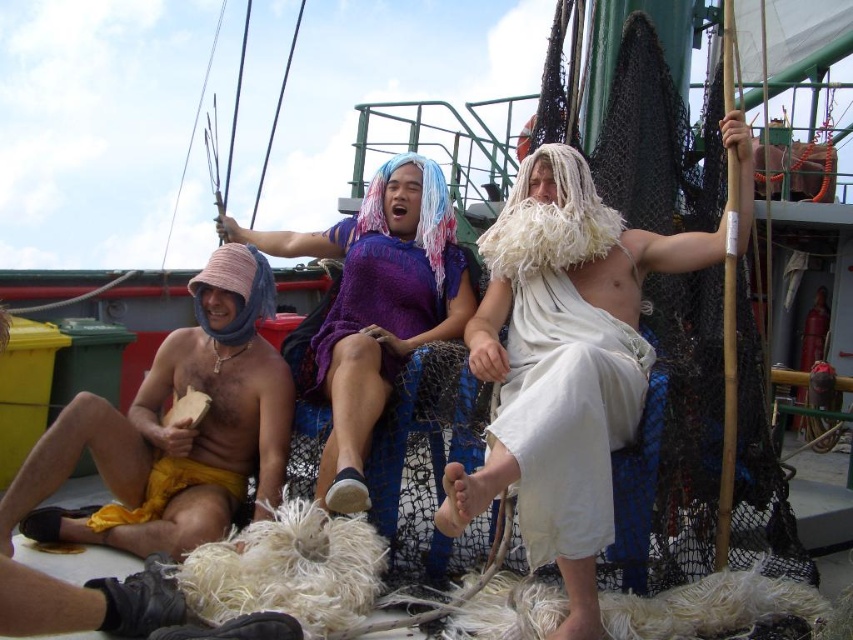
Between point (273, 468) and point (584, 321), which one is positioned in front?

Point (584, 321) is in front.

Is the position of matte yellow shorts at left less distant than that of white cloth at center?

No, it is not.

The width and height of the screenshot is (853, 640). Find the location of `matte yellow shorts at left`. matte yellow shorts at left is located at coordinates (173, 429).

Where is `matte yellow shorts at left`? This screenshot has height=640, width=853. matte yellow shorts at left is located at coordinates (173, 429).

You are a GUI agent. You are given a task and a screenshot of the screen. Output one action in this format:
    pyautogui.click(x=<x>, y=<y>)
    Task: Click on the matte yellow shorts at left
    
    Given the screenshot: What is the action you would take?
    pyautogui.click(x=173, y=429)

Is matte yellow shorts at left smaller than purple knitted robe at center?

Actually, matte yellow shorts at left might be larger than purple knitted robe at center.

The image size is (853, 640). What do you see at coordinates (173, 429) in the screenshot?
I see `matte yellow shorts at left` at bounding box center [173, 429].

Image resolution: width=853 pixels, height=640 pixels. Find the location of `matte yellow shorts at left`. matte yellow shorts at left is located at coordinates (173, 429).

Does white clothed man at center have a greater width compared to matte yellow shorts at left?

Correct, the width of white clothed man at center exceeds that of matte yellow shorts at left.

You are a GUI agent. You are given a task and a screenshot of the screen. Output one action in this format:
    pyautogui.click(x=<x>, y=<y>)
    Task: Click on the white clothed man at center
    
    Given the screenshot: What is the action you would take?
    point(561,365)

Find the location of `white clothed man at center`. white clothed man at center is located at coordinates (561, 365).